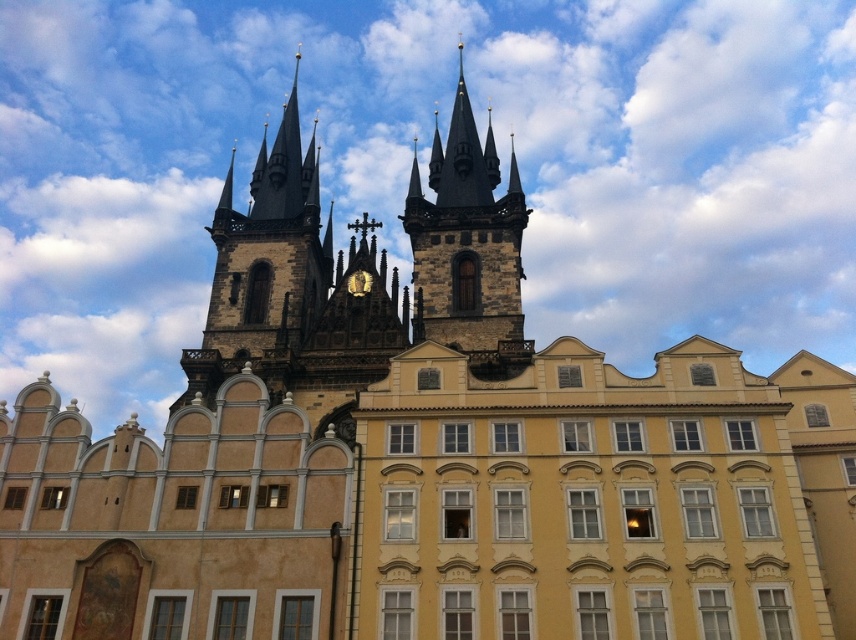
Question: Which point is closer to the camera taking this photo?

Choices:
 (A) (496, 212)
 (B) (244, 237)

Answer: (A)

Question: Is dark gray stone tower at upper center to the left of dark brown stone tower at center from the viewer's perspective?

Choices:
 (A) no
 (B) yes

Answer: (B)

Question: Observing the image, what is the correct spatial positioning of dark gray stone tower at upper center in reference to dark brown stone tower at center?

Choices:
 (A) below
 (B) above

Answer: (A)

Question: Does dark gray stone tower at upper center have a smaller size compared to dark brown stone tower at center?

Choices:
 (A) yes
 (B) no

Answer: (B)

Question: Which of the following is the farthest from the observer?

Choices:
 (A) 330,234
 (B) 428,294

Answer: (A)